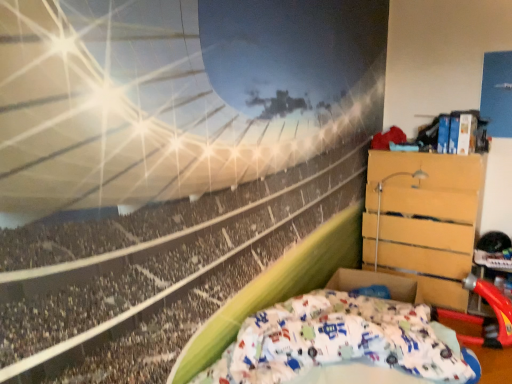
Question: Considering the relative positions of wooden chest of drawers at right and white cotton bed at lower right in the image provided, is wooden chest of drawers at right to the left of white cotton bed at lower right from the viewer's perspective?

Choices:
 (A) yes
 (B) no

Answer: (B)

Question: Is the surface of wooden chest of drawers at right in direct contact with white cotton bed at lower right?

Choices:
 (A) no
 (B) yes

Answer: (A)

Question: From the image's perspective, is wooden chest of drawers at right under white cotton bed at lower right?

Choices:
 (A) yes
 (B) no

Answer: (B)

Question: Is wooden chest of drawers at right surrounding white cotton bed at lower right?

Choices:
 (A) yes
 (B) no

Answer: (B)

Question: Is wooden chest of drawers at right bigger than white cotton bed at lower right?

Choices:
 (A) no
 (B) yes

Answer: (B)

Question: Considering the relative sizes of wooden chest of drawers at right and white cotton bed at lower right in the image provided, is wooden chest of drawers at right wider than white cotton bed at lower right?

Choices:
 (A) no
 (B) yes

Answer: (A)

Question: From a real-world perspective, is white cotton bed at lower right located higher than wooden chest of drawers at right?

Choices:
 (A) no
 (B) yes

Answer: (A)

Question: Is wooden chest of drawers at right a part of white cotton bed at lower right?

Choices:
 (A) yes
 (B) no

Answer: (B)

Question: Does white cotton bed at lower right appear on the left side of wooden chest of drawers at right?

Choices:
 (A) no
 (B) yes

Answer: (B)

Question: Is white cotton bed at lower right outside of wooden chest of drawers at right?

Choices:
 (A) yes
 (B) no

Answer: (A)

Question: Is white cotton bed at lower right thinner than wooden chest of drawers at right?

Choices:
 (A) no
 (B) yes

Answer: (A)

Question: From the image's perspective, is white cotton bed at lower right under wooden chest of drawers at right?

Choices:
 (A) yes
 (B) no

Answer: (A)

Question: Looking at the image, does white cotton bed at lower right seem bigger or smaller compared to wooden chest of drawers at right?

Choices:
 (A) big
 (B) small

Answer: (B)